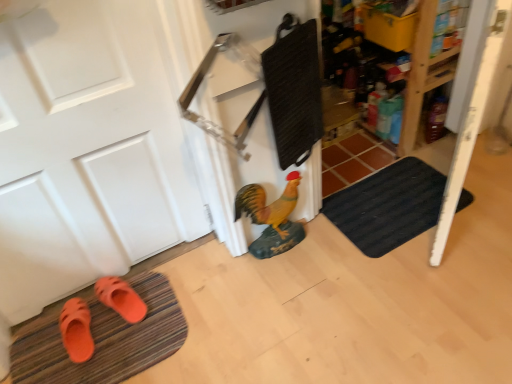
This screenshot has height=384, width=512. What are the coordinates of `vacant space in between black textured bath mat at lower right, positioned as the first bath mat in top-to-bottom order, and orange rubber bath mat at lower left, which appears as the second bath mat when viewed from the top` in the screenshot? It's located at (250, 280).